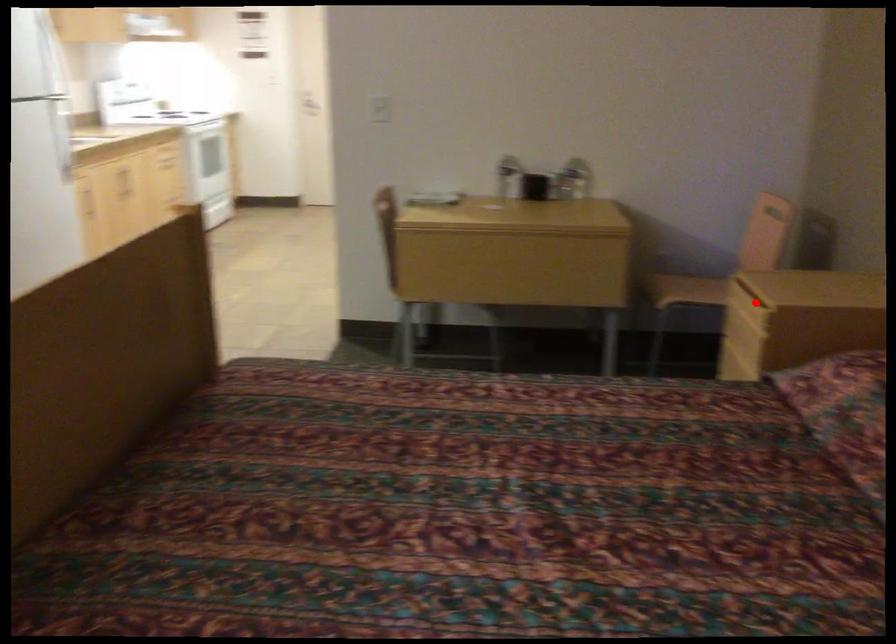
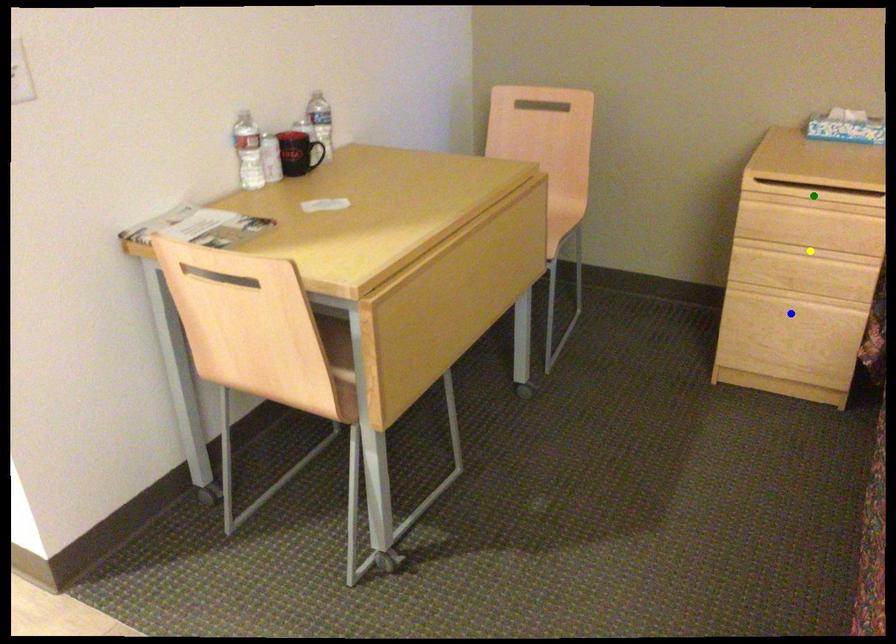
Question: I am providing you with two images of the same scene from different viewpoints. A red point is marked on the first image. You are given multiple points on the second image. Which point in image 2 is actually the same real-world point as the red point in image 1?

Choices:
 (A) green point
 (B) yellow point
 (C) blue point

Answer: (A)